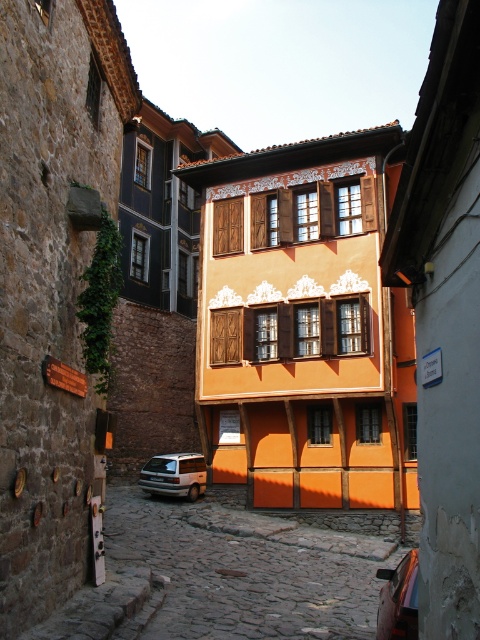
Question: Can you confirm if cobblestone street at center is positioned above shiny black car at center?

Choices:
 (A) yes
 (B) no

Answer: (B)

Question: Is cobblestone street at center below white matte van at lower center?

Choices:
 (A) no
 (B) yes

Answer: (B)

Question: Which point appears farthest from the camera in this image?

Choices:
 (A) (269, 628)
 (B) (140, 477)
 (C) (388, 616)

Answer: (B)

Question: Which of the following is the farthest from the observer?

Choices:
 (A) (168, 560)
 (B) (153, 461)

Answer: (B)

Question: Estimate the real-world distances between objects in this image. Which object is closer to the white matte van at lower center?

Choices:
 (A) cobblestone street at center
 (B) shiny black car at center

Answer: (A)

Question: Does cobblestone street at center have a smaller size compared to shiny black car at center?

Choices:
 (A) yes
 (B) no

Answer: (B)